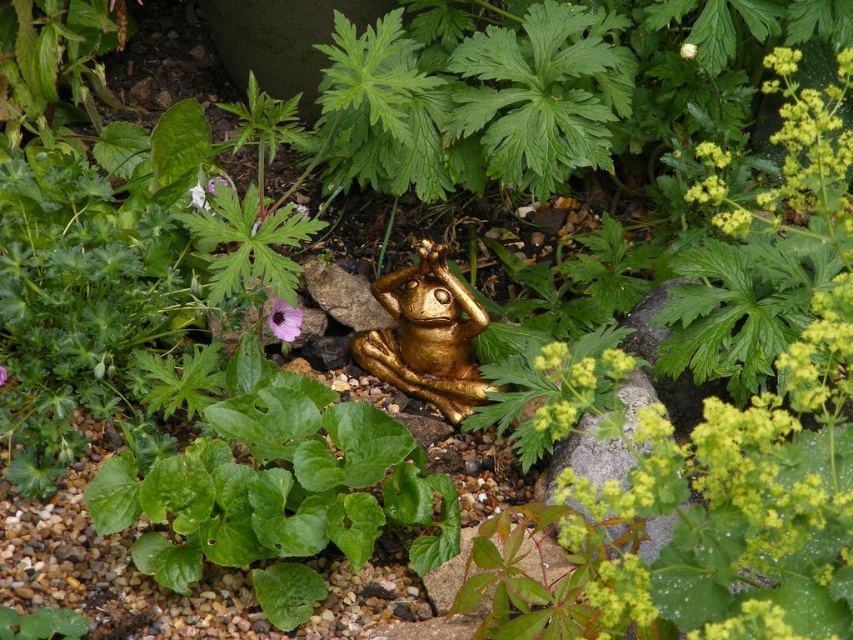
Is gold metallic frog at center above purple matte flower at center?

No.

Between gold metallic frog at center and purple matte flower at center, which one appears on the right side from the viewer's perspective?

From the viewer's perspective, gold metallic frog at center appears more on the right side.

Who is more forward, (x=440, y=285) or (x=283, y=337)?

Positioned in front is point (x=283, y=337).

Locate an element on the screen. gold metallic frog at center is located at coordinates (427, 336).